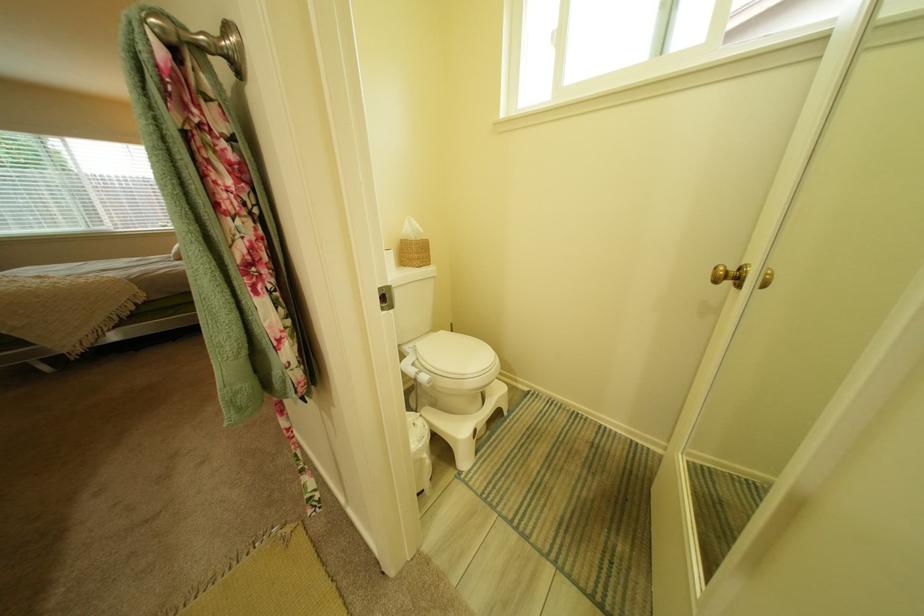
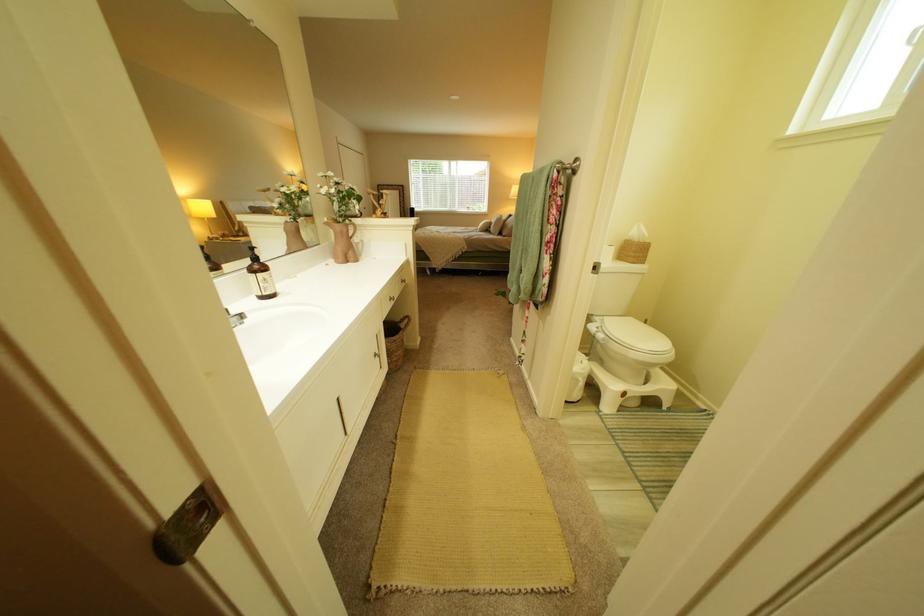
In the second image, find the point that corresponds to pixel 419 233 in the first image.

(646, 236)